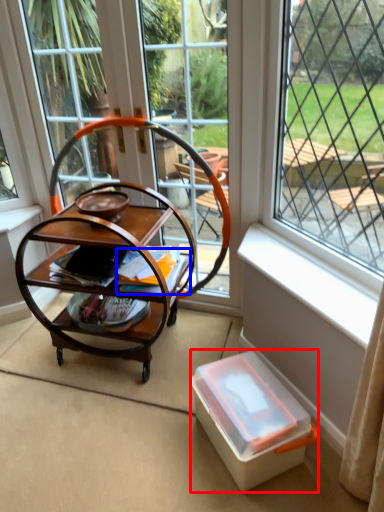
Question: Which object appears closest to the camera in this image, box (highlighted by a red box) or magazine (highlighted by a blue box)?

Choices:
 (A) box
 (B) magazine

Answer: (A)